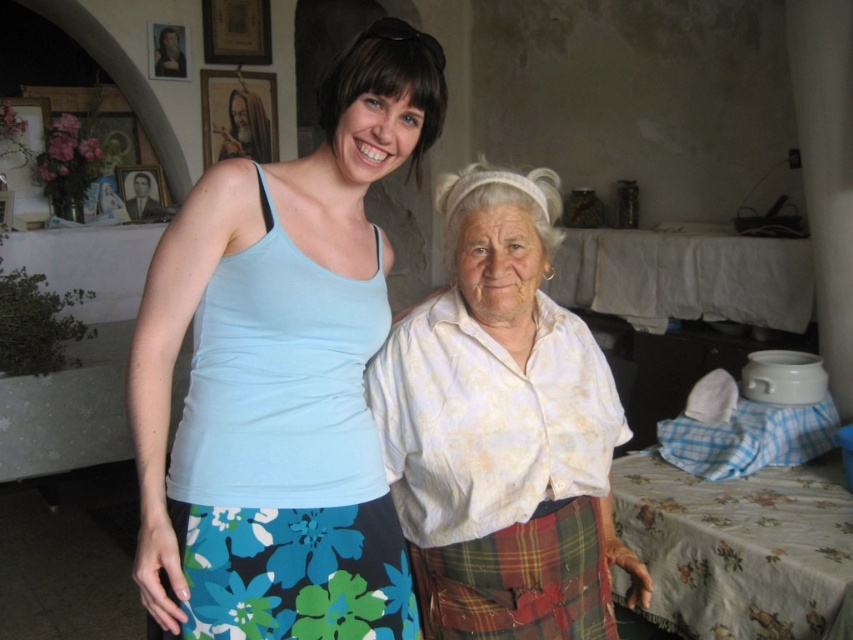
You are organizing a costume party and need to decide which item to use as a tablecloth. Given the plaid wool kilt at lower center and the white cloth at center, which one would be more suitable based on their sizes?

The white cloth at center is larger than the plaid wool kilt at lower center, making it more suitable as a tablecloth due to its bigger size.

You are a photographer setting up a shoot in this scene. You need to place a small prop between the plaid wool kilt at lower center and the white cloth at center. Based on their positions, where should you place the prop to ensure it is between them?

The plaid wool kilt at lower center is located below the white cloth at center, so placing the prop between them would require positioning it above the plaid wool kilt at lower center and below the white cloth at center.

You are arranging a photo shoot in this scene and need to place a small decorative item between the white cloth at center and the wooden frame at upper center. Based on their positions, where should you place the item to ensure it is between them?

The white cloth at center is positioned under the wooden frame at upper center, so placing the item just below the wooden frame at upper center but above the white cloth at center would position it between them.